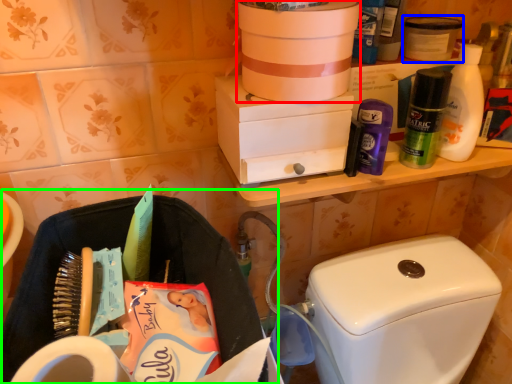
Question: Which object is the farthest from box (highlighted by a red box)? Choose among these: product (highlighted by a blue box) or laundry basket (highlighted by a green box).

Choices:
 (A) product
 (B) laundry basket

Answer: (B)